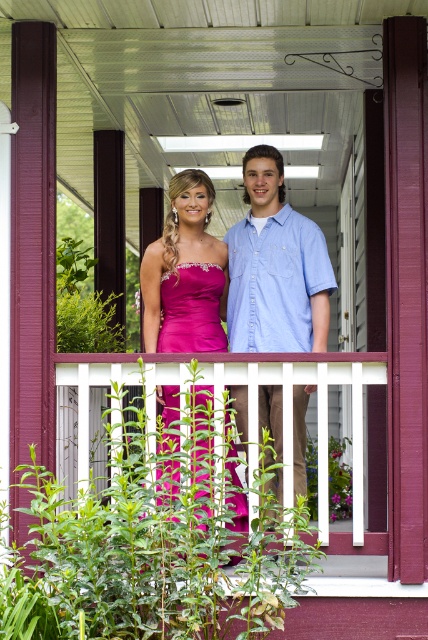
You are standing at the bottom of the porch steps. You want to take a photo of the light blue denim shirt at center. Where should you aim your camera?

You should aim your camera at point 0.419 on the horizontal axis and 0.645 on the vertical axis to capture the light blue denim shirt at center.

You are a photographer trying to capture a group photo of the light blue denim shirt at center and the shiny satin dress at center. You want to ensure that both subjects are in focus. Given that your camera has a fixed focus range, which subject should you prioritize focusing on to ensure the best clarity for both?

Since the light blue denim shirt at center is wider than the shiny satin dress at center, you should focus on the light blue denim shirt at center first to ensure both are in focus.